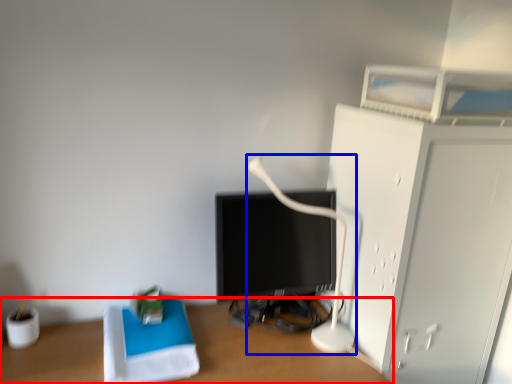
Question: Which point is closer to the camera, desk (highlighted by a red box) or table lamp (highlighted by a blue box)?

Choices:
 (A) desk
 (B) table lamp

Answer: (A)